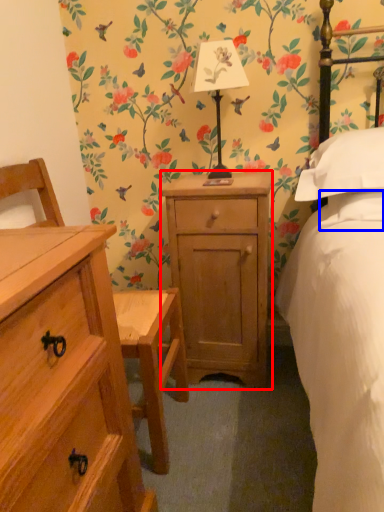
Question: Which point is closer to the camera, nightstand (highlighted by a red box) or pillow (highlighted by a blue box)?

Choices:
 (A) nightstand
 (B) pillow

Answer: (B)